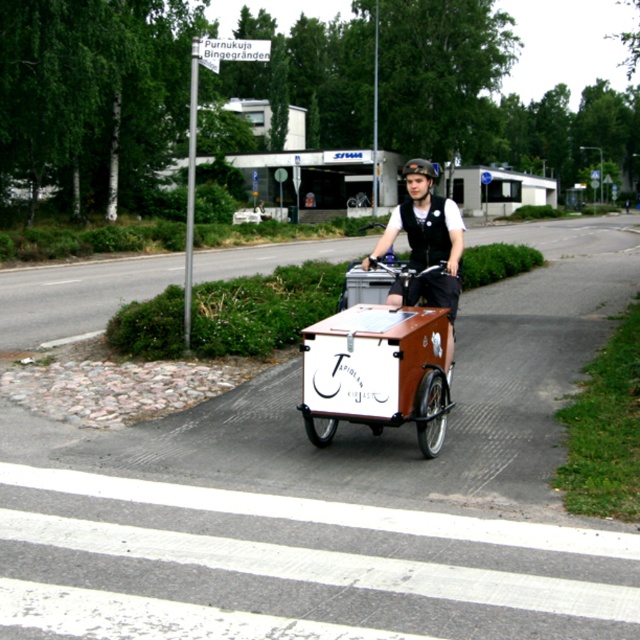
Does brown matte cargo bike at center appear on the left side of matte black vest at center?

Indeed, brown matte cargo bike at center is positioned on the left side of matte black vest at center.

Between brown matte cargo bike at center and matte black vest at center, which one appears on the right side from the viewer's perspective?

From the viewer's perspective, matte black vest at center appears more on the right side.

Find the location of `brown matte cargo bike at center`. brown matte cargo bike at center is located at coordinates (378, 372).